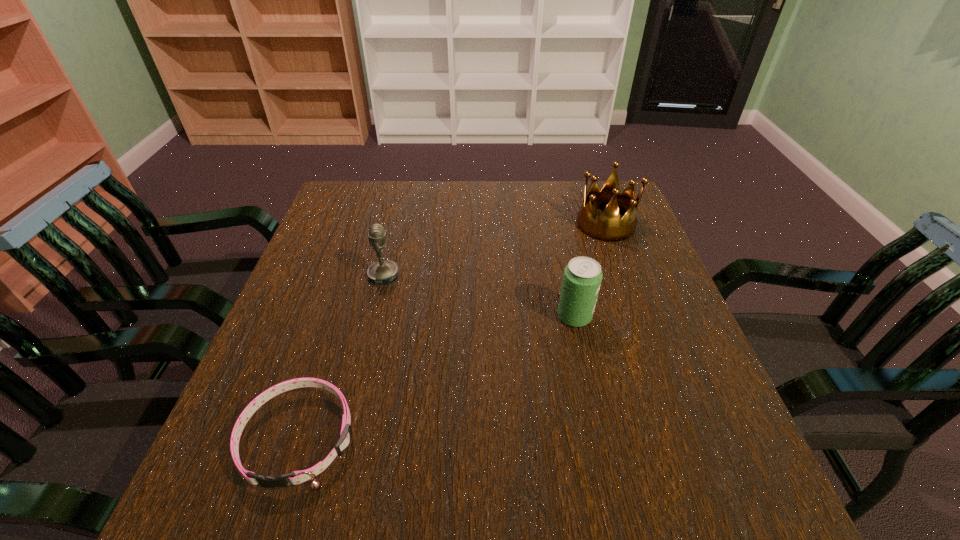
This screenshot has height=540, width=960. What are the coordinates of `object that is at the far edge` in the screenshot? It's located at (608, 227).

The image size is (960, 540). Identify the location of object positioned at the near edge. (296, 477).

Find the location of `object that is at the left edge`. object that is at the left edge is located at coordinates (296, 477).

Locate an element on the screen. The width and height of the screenshot is (960, 540). object that is at the right edge is located at coordinates (608, 227).

Locate an element on the screen. This screenshot has width=960, height=540. object present at the near left corner is located at coordinates (296, 477).

At what (x,y) coordinates should I click in order to perform the action: click on object that is at the far right corner. Please return your answer as a coordinate pair (x, y). The image size is (960, 540). Looking at the image, I should click on (608, 227).

Image resolution: width=960 pixels, height=540 pixels. In the image, there is a desktop. What are the coordinates of `vacant space at the far edge` in the screenshot? It's located at (525, 194).

This screenshot has height=540, width=960. What are the coordinates of `vacant space at the near edge of the desktop` in the screenshot? It's located at (356, 485).

Find the location of a particular element. Image resolution: width=960 pixels, height=540 pixels. free space at the left edge of the desktop is located at coordinates (316, 238).

I want to click on vacant region at the far left corner of the desktop, so 337,208.